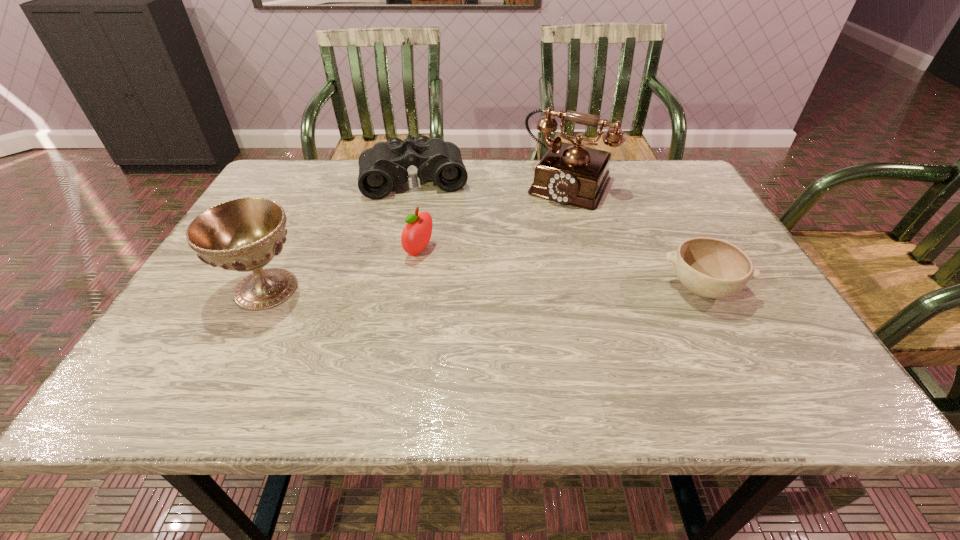
Where is `free location located at the eyepieces of the binoculars`? The height and width of the screenshot is (540, 960). free location located at the eyepieces of the binoculars is located at coordinates (429, 255).

Find the location of `vacant space located 0.390m at the eyepieces of the binoculars`. vacant space located 0.390m at the eyepieces of the binoculars is located at coordinates (438, 303).

I want to click on free spot located at the eyepieces of the binoculars, so click(425, 227).

Where is `vacant space located on the dial of the tallest object`? The image size is (960, 540). vacant space located on the dial of the tallest object is located at coordinates click(x=541, y=228).

Locate an element on the screen. free space located on the dial of the tallest object is located at coordinates point(545,222).

At what (x,y) coordinates should I click in order to perform the action: click on vacant area situated on the dial of the tallest object. Please return your answer as a coordinate pair (x, y). The image size is (960, 540). Looking at the image, I should click on (548, 218).

Locate an element on the screen. vacant space located on the front-facing side of the apple is located at coordinates (460, 269).

Image resolution: width=960 pixels, height=540 pixels. In order to click on free space located on the front-facing side of the apple in this screenshot , I will do `click(549, 305)`.

Find the location of a particular element. This screenshot has height=540, width=960. vacant space located 0.330m on the front-facing side of the apple is located at coordinates (563, 310).

Locate an element on the screen. binoculars located in the far edge section of the desktop is located at coordinates (385, 165).